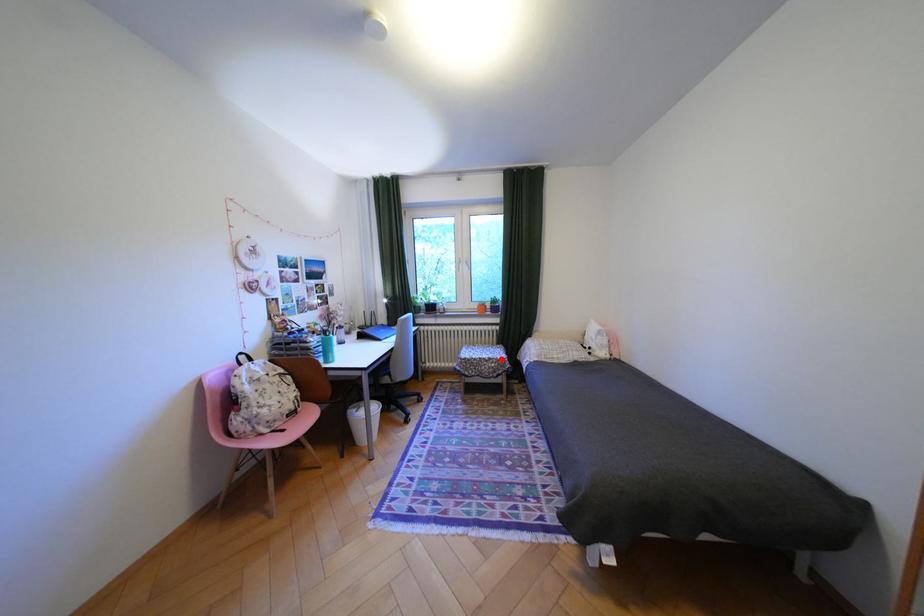
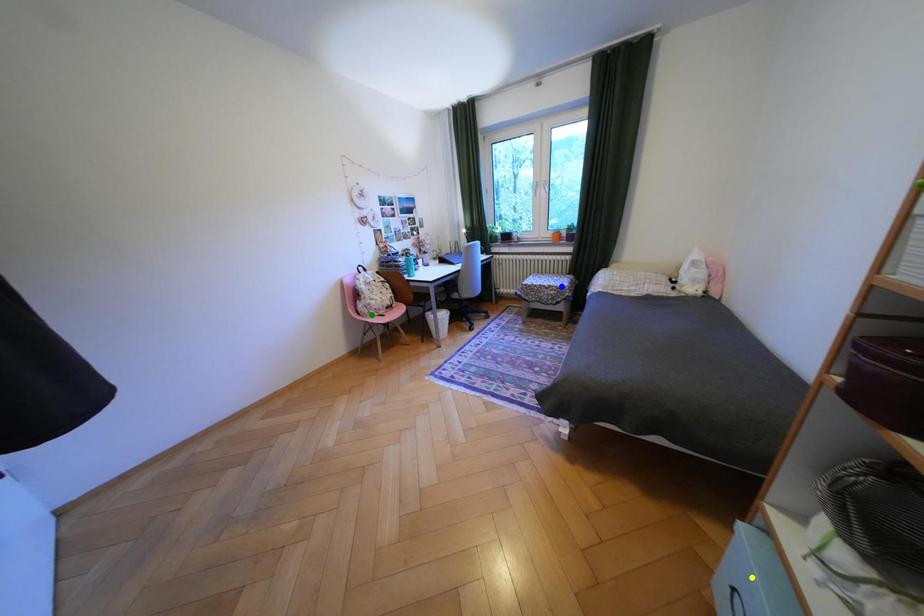
Question: I am providing you with two images of the same scene from different viewpoints. A red point is marked on the first image. You are given multiple points on the second image. Which mark in image 2 goes with the point in image 1?

Choices:
 (A) yellow point
 (B) green point
 (C) blue point

Answer: (C)